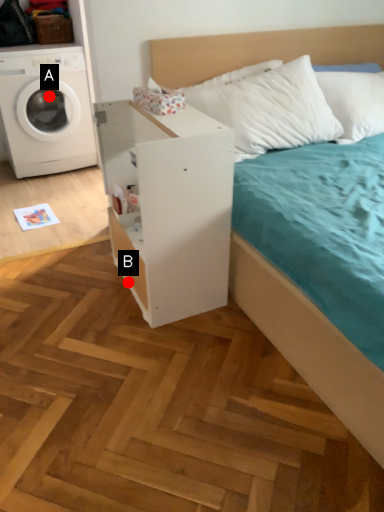
Question: Two points are circled on the image, labeled by A and B beside each circle. Which of the following is the closest to the observer?

Choices:
 (A) A is closer
 (B) B is closer

Answer: (B)